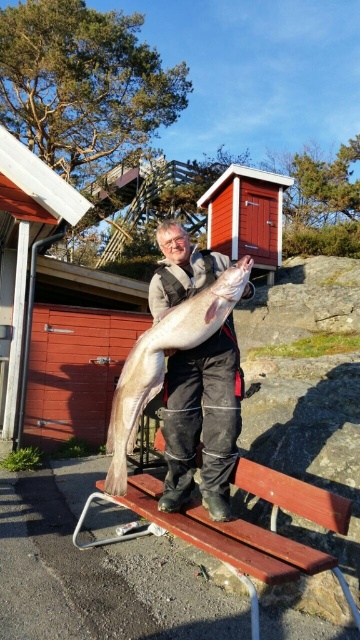
You are a photographer trying to take a picture of the wooden bench at center and the shiny silver fish at center. Which object should you focus on first if you want to capture both clearly in your photo?

The wooden bench at center is closer to the viewer than the shiny silver fish at center, so you should focus on the wooden bench at center first to ensure both are in focus.

You are a photographer trying to capture the wooden bench at center and the shiny silver fish at center in the same frame. Since the bench is larger, will it block the fish from view?

The wooden bench at center is larger in size than the shiny silver fish at center, so it might block the fish from view depending on their positions.